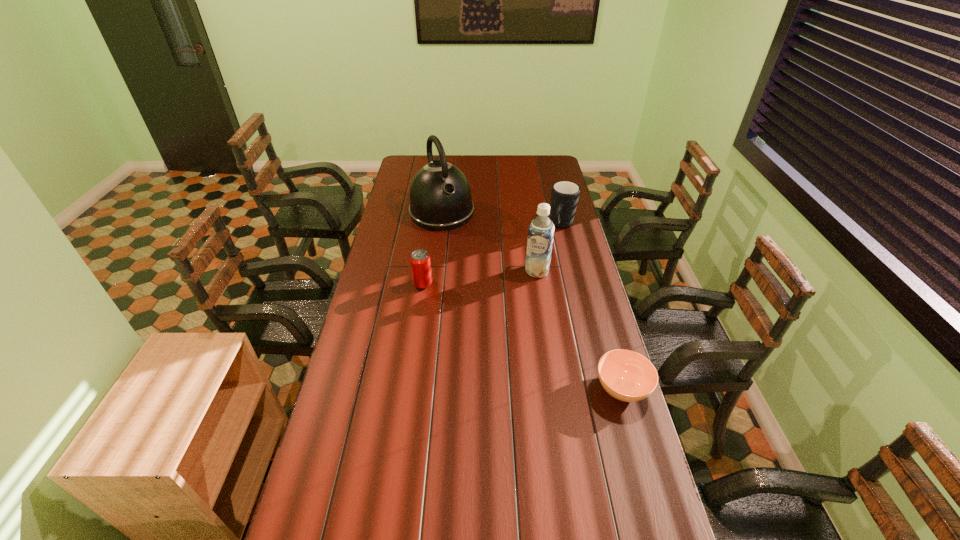
Identify the location of the fourth tallest object. (420, 262).

Image resolution: width=960 pixels, height=540 pixels. I want to click on the nearest object, so click(x=627, y=376).

At what (x,y) coordinates should I click in order to perform the action: click on the shortest object. Please return your answer as a coordinate pair (x, y). This screenshot has height=540, width=960. Looking at the image, I should click on (627, 376).

Identify the location of the third object from left to right. (541, 231).

This screenshot has width=960, height=540. What are the coordinates of `soya milk` in the screenshot? It's located at (541, 231).

You are a GUI agent. You are given a task and a screenshot of the screen. Output one action in this format:
    pyautogui.click(x=<x>, y=<y>)
    Task: Click on the third shortest object
    The width and height of the screenshot is (960, 540).
    Given the screenshot: What is the action you would take?
    pyautogui.click(x=564, y=194)

What are the coordinates of `kettle` in the screenshot? It's located at (440, 196).

Locate an element on the screen. The width and height of the screenshot is (960, 540). blank space located 0.200m on the right of the can is located at coordinates (483, 284).

I want to click on vacant space located on the back of the soup bowl, so click(x=610, y=346).

Where is `blank space located 0.200m on the label of the second tallest object`? This screenshot has width=960, height=540. blank space located 0.200m on the label of the second tallest object is located at coordinates pyautogui.click(x=522, y=312).